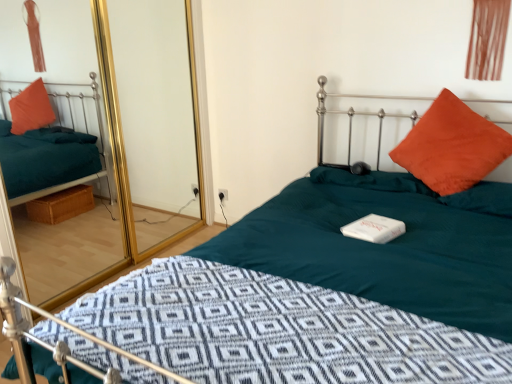
Measure the distance between transparent glass door at upper left and camera.

The distance of transparent glass door at upper left from camera is 2.33 meters.

This screenshot has width=512, height=384. I want to click on transparent glass door at upper left, so click(103, 138).

From a real-world perspective, does transparent glass door at upper left sit lower than orange suede pillow at upper right?

No.

Based on the photo, is transparent glass door at upper left positioned with its back to orange suede pillow at upper right?

That's not correct — transparent glass door at upper left is not looking away from orange suede pillow at upper right.

From the image's perspective, is transparent glass door at upper left over orange suede pillow at upper right?

Correct, transparent glass door at upper left appears higher than orange suede pillow at upper right in the image.

Can you confirm if transparent glass door at upper left is shorter than orange suede pillow at upper right?

No.

Who is shorter, orange suede pillow at upper right or brown fabric curtain at upper right?

brown fabric curtain at upper right.

Considering the sizes of orange suede pillow at upper right and brown fabric curtain at upper right in the image, is orange suede pillow at upper right wider or thinner than brown fabric curtain at upper right?

Clearly, orange suede pillow at upper right has more width compared to brown fabric curtain at upper right.

Considering the relative positions of orange suede pillow at upper right and brown fabric curtain at upper right in the image provided, is orange suede pillow at upper right to the left or to the right of brown fabric curtain at upper right?

In the image, orange suede pillow at upper right appears on the left side of brown fabric curtain at upper right.

Which object is positioned more to the right, brown fabric curtain at upper right or transparent glass door at upper left?

Answer: brown fabric curtain at upper right.

Measure the distance from brown fabric curtain at upper right to transparent glass door at upper left.

The distance of brown fabric curtain at upper right from transparent glass door at upper left is 2.55 meters.

Looking at the image, does brown fabric curtain at upper right seem bigger or smaller compared to transparent glass door at upper left?

In the image, brown fabric curtain at upper right appears to be smaller than transparent glass door at upper left.

Between brown fabric curtain at upper right and transparent glass door at upper left, which one is positioned behind?

brown fabric curtain at upper right is behind.

Considering the sizes of objects transparent glass door at upper left and brown fabric curtain at upper right in the image provided, who is smaller, transparent glass door at upper left or brown fabric curtain at upper right?

Smaller between the two is brown fabric curtain at upper right.

In the scene shown: Is there a large distance between transparent glass door at upper left and brown fabric curtain at upper right?

transparent glass door at upper left is far away from brown fabric curtain at upper right.

Would you say brown fabric curtain at upper right is part of transparent glass door at upper left's contents?

Actually, brown fabric curtain at upper right is outside transparent glass door at upper left.

Which object is thinner, transparent glass door at upper left or brown fabric curtain at upper right?

brown fabric curtain at upper right is thinner.

How much distance is there between brown fabric curtain at upper right and orange suede pillow at upper right?

brown fabric curtain at upper right is 16.54 inches away from orange suede pillow at upper right.

The height and width of the screenshot is (384, 512). I want to click on curtain located on the right of orange suede pillow at upper right, so click(x=487, y=39).

Between brown fabric curtain at upper right and orange suede pillow at upper right, which one has larger width?

orange suede pillow at upper right is wider.

Is brown fabric curtain at upper right at the right side of orange suede pillow at upper right?

Yes.

Can you see orange suede pillow at upper right touching transparent glass door at upper left?

No, orange suede pillow at upper right is not beside transparent glass door at upper left.

Does point (434, 172) come in front of point (132, 17)?

Yes, it is.

The image size is (512, 384). Identify the location of pillow behind the transparent glass door at upper left. (452, 146).

Which of these two, orange suede pillow at upper right or transparent glass door at upper left, stands taller?

transparent glass door at upper left.

Identify the location of pillow below the transparent glass door at upper left (from the image's perspective). (452, 146).

The height and width of the screenshot is (384, 512). I want to click on pillow in front of the brown fabric curtain at upper right, so click(452, 146).

From the image, which object appears to be nearer to orange suede pillow at upper right, brown fabric curtain at upper right or transparent glass door at upper left?

The object closer to orange suede pillow at upper right is brown fabric curtain at upper right.

Which object lies further to the anchor point brown fabric curtain at upper right, orange suede pillow at upper right or transparent glass door at upper left?

transparent glass door at upper left is further to brown fabric curtain at upper right.

Estimate the real-world distances between objects in this image. Which object is closer to brown fabric curtain at upper right, transparent glass door at upper left or orange suede pillow at upper right?

Among the two, orange suede pillow at upper right is located nearer to brown fabric curtain at upper right.

From the image, which object appears to be nearer to transparent glass door at upper left, brown fabric curtain at upper right or orange suede pillow at upper right?

orange suede pillow at upper right lies closer to transparent glass door at upper left than the other object.

From the image, which object appears to be nearer to orange suede pillow at upper right, transparent glass door at upper left or brown fabric curtain at upper right?

Based on the image, brown fabric curtain at upper right appears to be nearer to orange suede pillow at upper right.

Consider the image. Based on their spatial positions, is orange suede pillow at upper right or brown fabric curtain at upper right closer to transparent glass door at upper left?

orange suede pillow at upper right is closer to transparent glass door at upper left.

Image resolution: width=512 pixels, height=384 pixels. What are the coordinates of `pillow between transparent glass door at upper left and brown fabric curtain at upper right` in the screenshot? It's located at (452, 146).